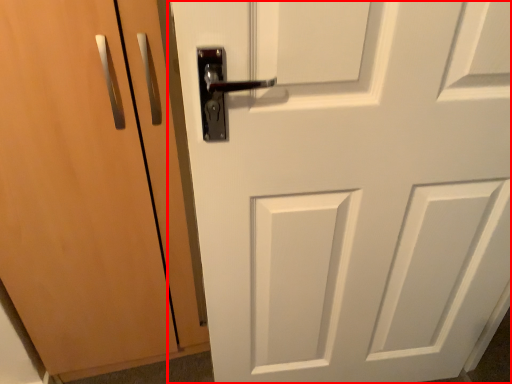
Question: Observing the image, what is the correct spatial positioning of door (annotated by the red box) in reference to door?

Choices:
 (A) left
 (B) right

Answer: (B)